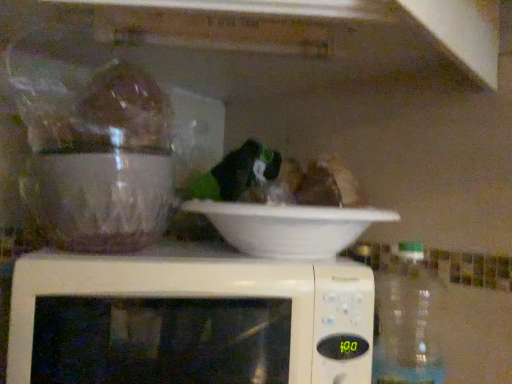
Question: From a real-world perspective, is white plastic microwave at center physically above transparent plastic bottle at right?

Choices:
 (A) yes
 (B) no

Answer: (B)

Question: Is white plastic microwave at center smaller than transparent plastic bottle at right?

Choices:
 (A) yes
 (B) no

Answer: (B)

Question: From the image's perspective, is white plastic microwave at center beneath transparent plastic bottle at right?

Choices:
 (A) yes
 (B) no

Answer: (B)

Question: Is white plastic microwave at center with transparent plastic bottle at right?

Choices:
 (A) yes
 (B) no

Answer: (B)

Question: From a real-world perspective, is white plastic microwave at center positioned under transparent plastic bottle at right based on gravity?

Choices:
 (A) no
 (B) yes

Answer: (B)

Question: Looking at the image, does white matte bowl at center seem bigger or smaller compared to transparent plastic bottle at right?

Choices:
 (A) big
 (B) small

Answer: (A)

Question: In terms of height, does white matte bowl at center look taller or shorter compared to transparent plastic bottle at right?

Choices:
 (A) short
 (B) tall

Answer: (A)

Question: Does point click(x=330, y=256) appear closer or farther from the camera than point click(x=442, y=347)?

Choices:
 (A) closer
 (B) farther

Answer: (A)

Question: Is white matte bowl at center in front of or behind transparent plastic bottle at right in the image?

Choices:
 (A) behind
 (B) front

Answer: (B)

Question: Does point (434, 362) appear closer or farther from the camera than point (192, 249)?

Choices:
 (A) farther
 (B) closer

Answer: (B)

Question: Is transparent plastic bottle at right taller or shorter than white plastic microwave at center?

Choices:
 (A) short
 (B) tall

Answer: (B)

Question: From a real-world perspective, is transparent plastic bottle at right above or below white plastic microwave at center?

Choices:
 (A) below
 (B) above

Answer: (B)

Question: Is transparent plastic bottle at right in front of or behind white plastic microwave at center in the image?

Choices:
 (A) front
 (B) behind

Answer: (B)

Question: From the image's perspective, is white plastic microwave at center positioned above or below white matte bowl at center?

Choices:
 (A) below
 (B) above

Answer: (A)

Question: From their relative heights in the image, would you say white plastic microwave at center is taller or shorter than white matte bowl at center?

Choices:
 (A) tall
 (B) short

Answer: (A)